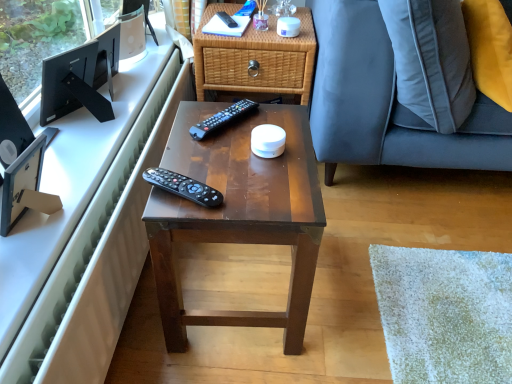
The image size is (512, 384). Identify the location of free space to the back side of black plastic remote control at center, the 3th remote control from the back. (197, 153).